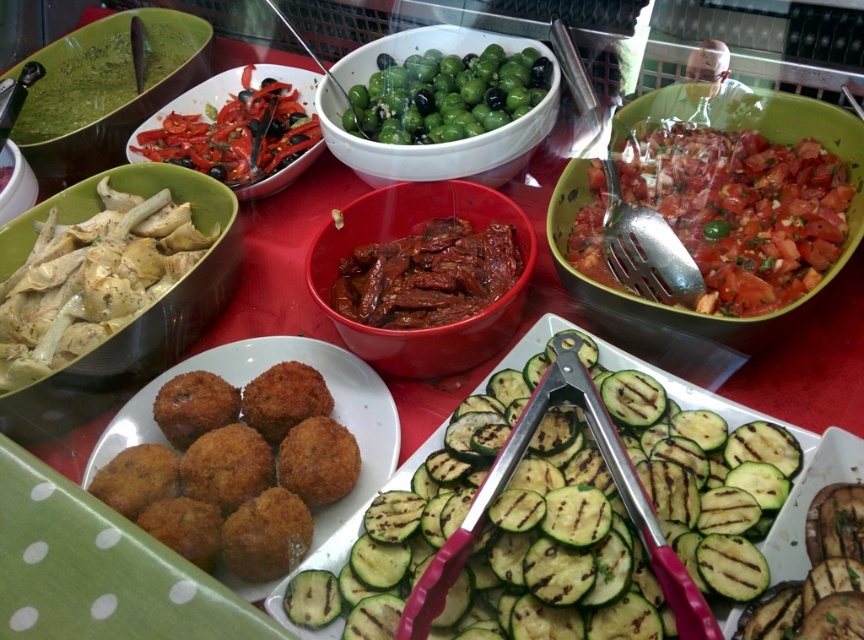
You are at a buffet and want to grab some food. You see the white creamy artichokes at left and the matte red bowl at center. Which one is placed higher up?

The white creamy artichokes at left is located above the matte red bowl at center, so it is placed higher up.